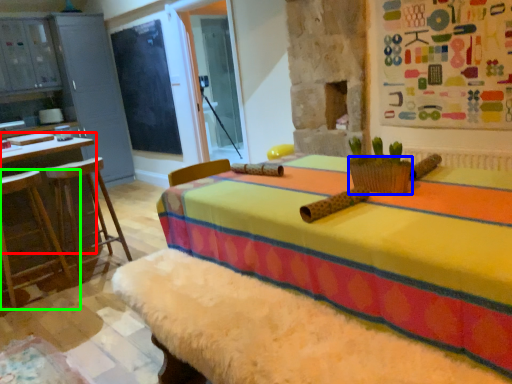
Question: Based on their relative distances, which object is farther from round table (highlighted by a red box)? Choose from basket (highlighted by a blue box) and furniture (highlighted by a green box).

Choices:
 (A) basket
 (B) furniture

Answer: (A)